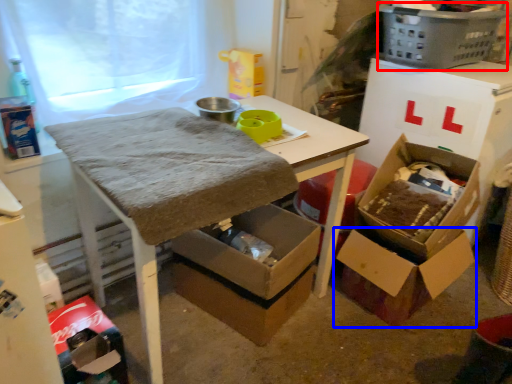
Question: Which point is further to the camera, basket (highlighted by a red box) or box (highlighted by a blue box)?

Choices:
 (A) basket
 (B) box

Answer: (A)